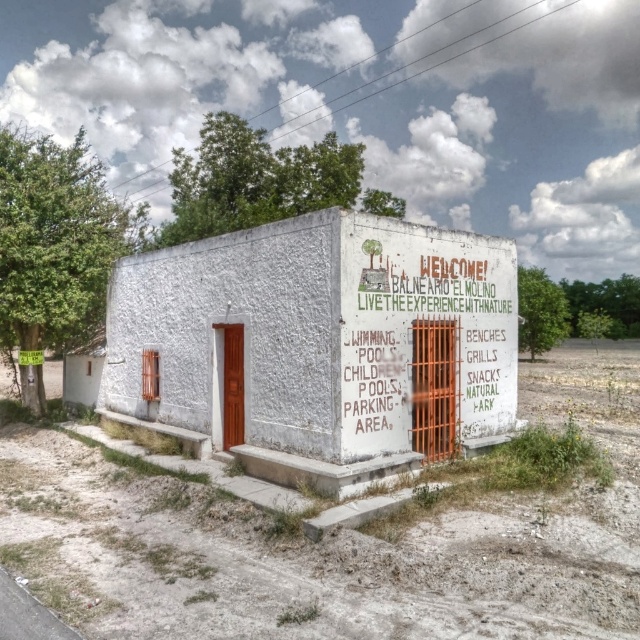
Which is in front, point (320, 358) or point (348, 374)?

Positioned in front is point (348, 374).

This screenshot has width=640, height=640. What do you see at coordinates (320, 344) in the screenshot?
I see `white stucco sign at center` at bounding box center [320, 344].

Is point (328, 387) positioned in front of point (508, 316)?

Yes, it is in front of point (508, 316).

In order to click on white stucco sign at center in this screenshot , I will do `click(320, 344)`.